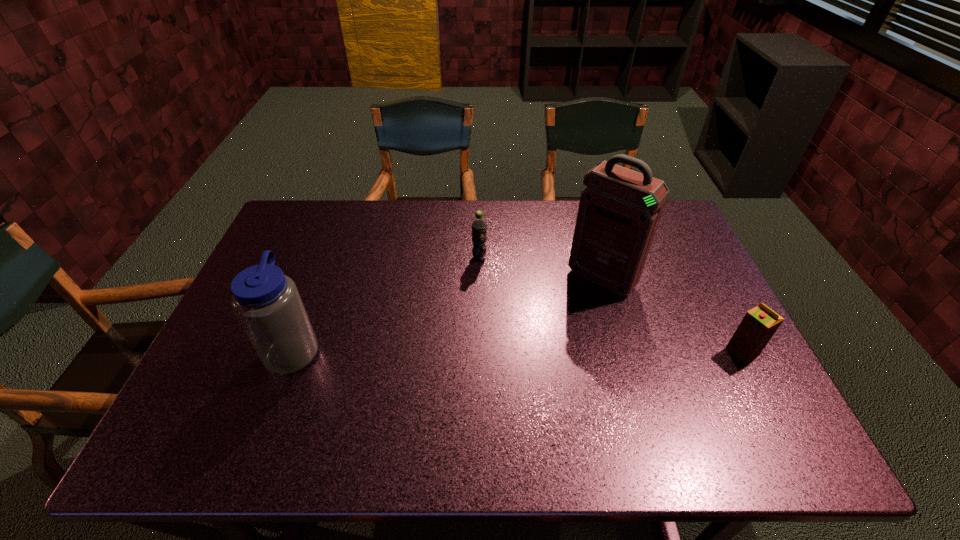
Image resolution: width=960 pixels, height=540 pixels. What are the coordinates of `free spot on the desktop that is between the water bottle and the rightmost object and is positioned on the front label of the second object from left to right` in the screenshot? It's located at point(492,350).

Locate an element on the screen. The image size is (960, 540). vacant space on the desktop that is between the water bottle and the orange juice and is positioned on the front-facing side of the tallest object is located at coordinates [x=539, y=350].